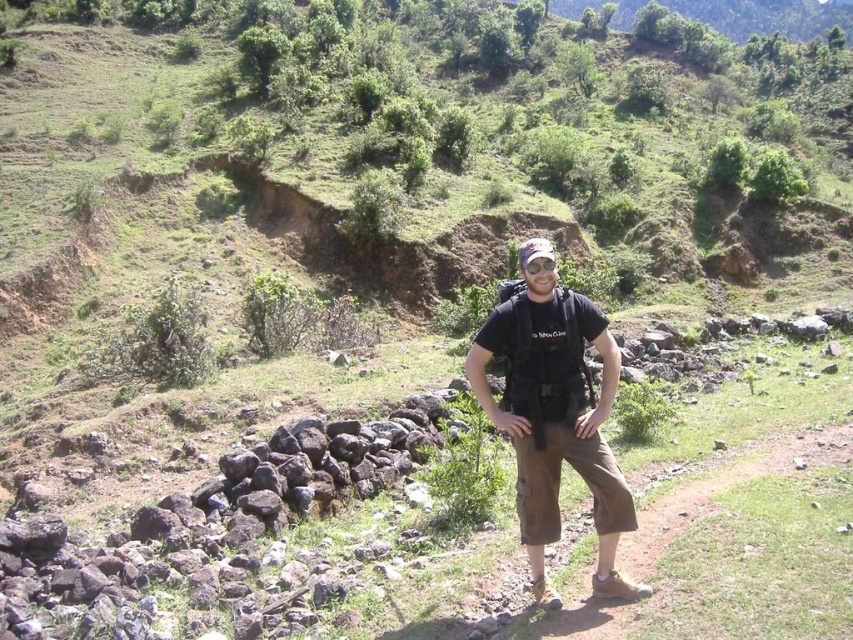
Question: Does brown cotton cargo pants at center have a lesser width compared to brown fabric pants at center?

Choices:
 (A) no
 (B) yes

Answer: (B)

Question: Is brown cotton cargo pants at center positioned at the back of brown fabric pants at center?

Choices:
 (A) no
 (B) yes

Answer: (B)

Question: Is brown cotton cargo pants at center to the left of brown fabric pants at center from the viewer's perspective?

Choices:
 (A) yes
 (B) no

Answer: (A)

Question: Which point is closer to the camera?

Choices:
 (A) (532, 244)
 (B) (627, 538)

Answer: (A)

Question: Which object is farther from the camera taking this photo?

Choices:
 (A) brown cotton cargo pants at center
 (B) brown fabric pants at center

Answer: (A)